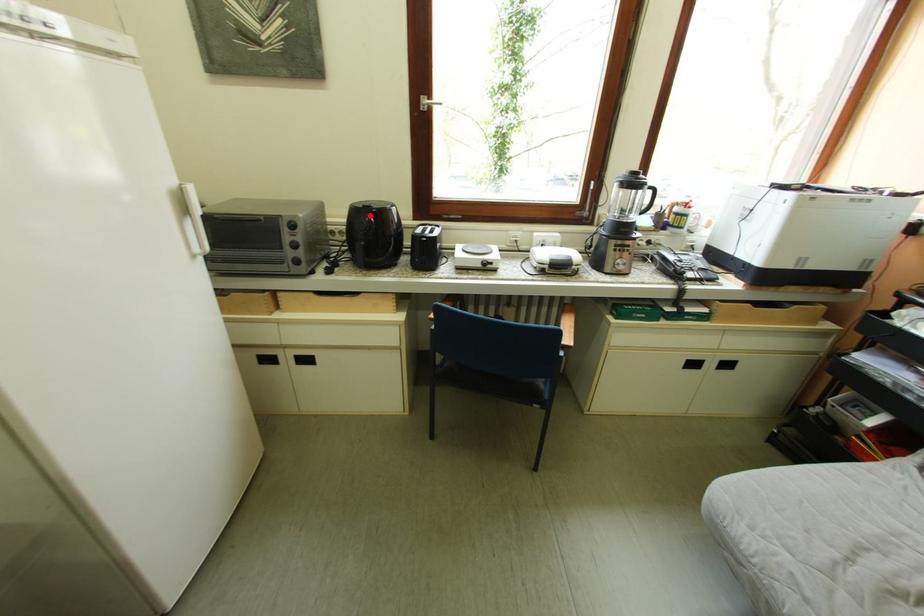
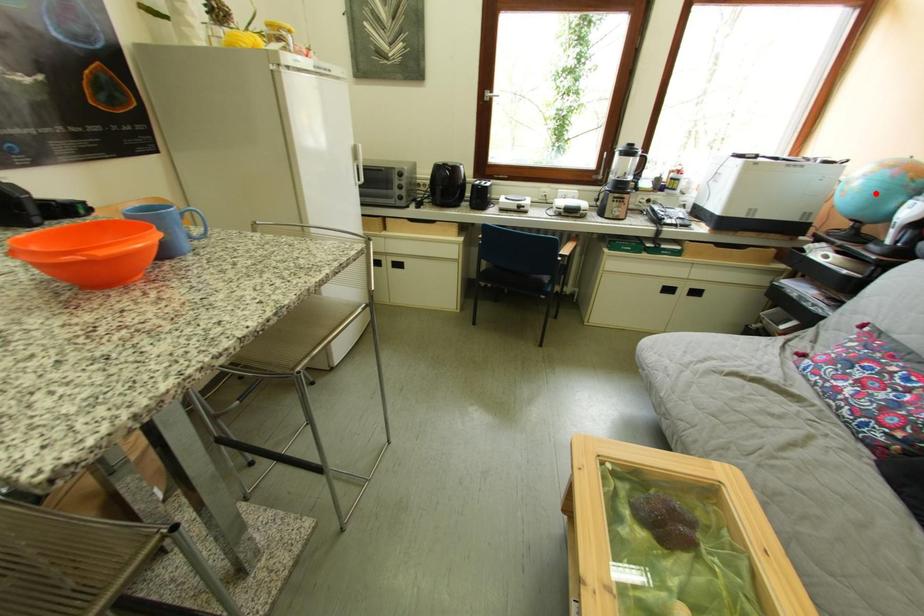
I am providing you with two images of the same scene from different viewpoints. A red point is marked on the first image and another point is marked on the second image. Does the point marked in image1 correspond to the same location as the one in image2?

No